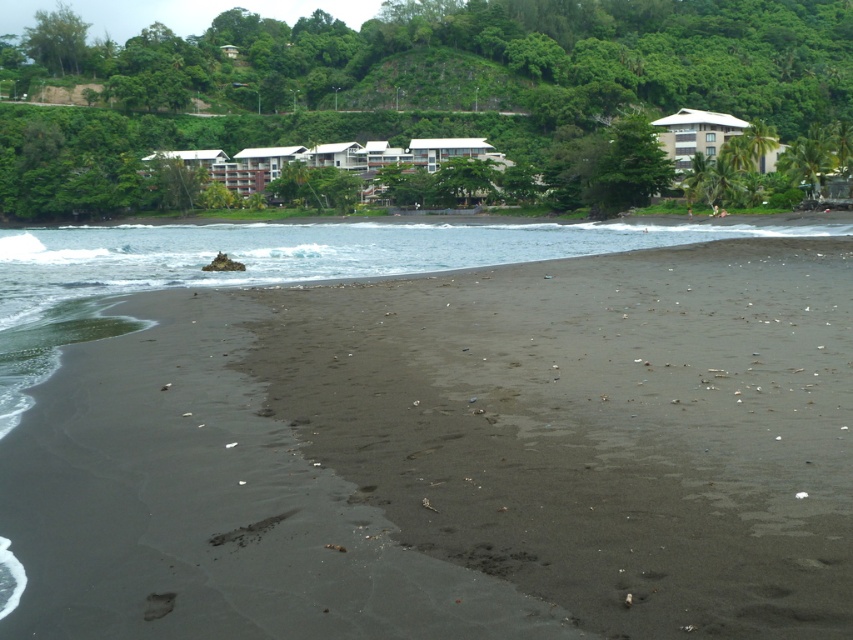
Is dark sand at center in front of white matte building at center?

Yes, it is.

Is dark sand at center bigger than white matte building at center?

No.

Is point (474, 385) behind point (488, 150)?

That is False.

I want to click on dark sand at center, so click(601, 426).